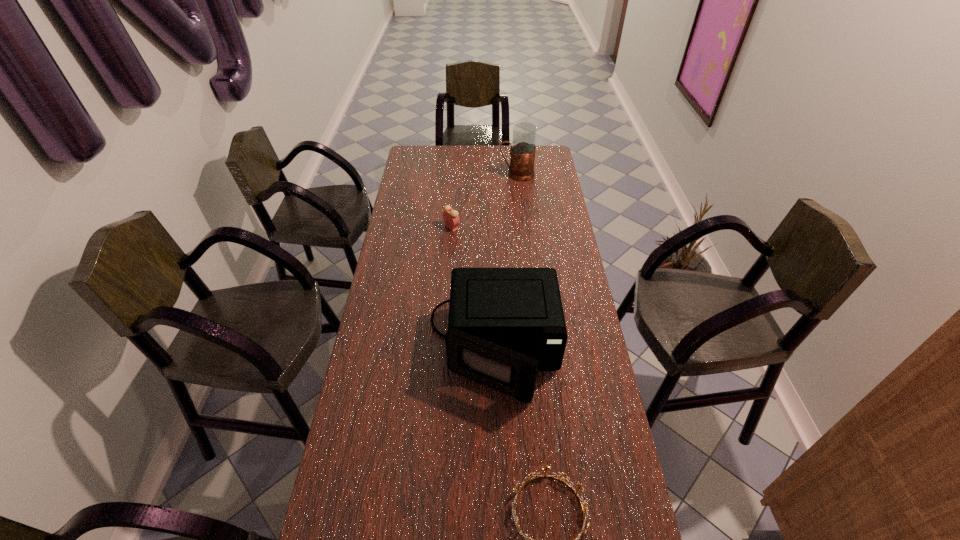
The width and height of the screenshot is (960, 540). Identify the location of free spot located 0.100m on the face of the third tallest object. (484, 227).

Locate an element on the screen. The image size is (960, 540). object located in the far edge section of the desktop is located at coordinates (522, 151).

Identify the location of pitcher that is at the right edge. Image resolution: width=960 pixels, height=540 pixels. (522, 151).

Where is `microwave oven located in the right edge section of the desktop`? Image resolution: width=960 pixels, height=540 pixels. microwave oven located in the right edge section of the desktop is located at coordinates (505, 324).

Locate an element on the screen. object present at the far right corner is located at coordinates (522, 151).

In the image, there is a desktop. Identify the location of vacant space at the far edge. The height and width of the screenshot is (540, 960). (473, 146).

Locate an element on the screen. vacant space at the left edge is located at coordinates (376, 298).

Image resolution: width=960 pixels, height=540 pixels. In the image, there is a desktop. Identify the location of free space at the right edge. (579, 270).

Identify the location of empty location between the tallest object and the third nearest object. The image size is (960, 540). (485, 201).

The image size is (960, 540). Find the location of `unoccupied area between the tallest object and the second nearest object`. unoccupied area between the tallest object and the second nearest object is located at coordinates pos(506,261).